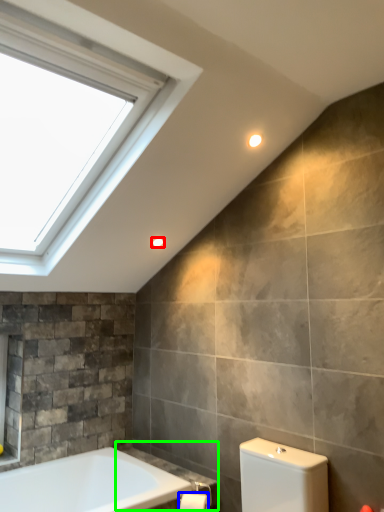
Question: Based on their relative distances, which object is nearer to light fixture (highlighted by a red box)? Choose from toilet paper (highlighted by a blue box) and counter top (highlighted by a green box).

Choices:
 (A) toilet paper
 (B) counter top

Answer: (B)